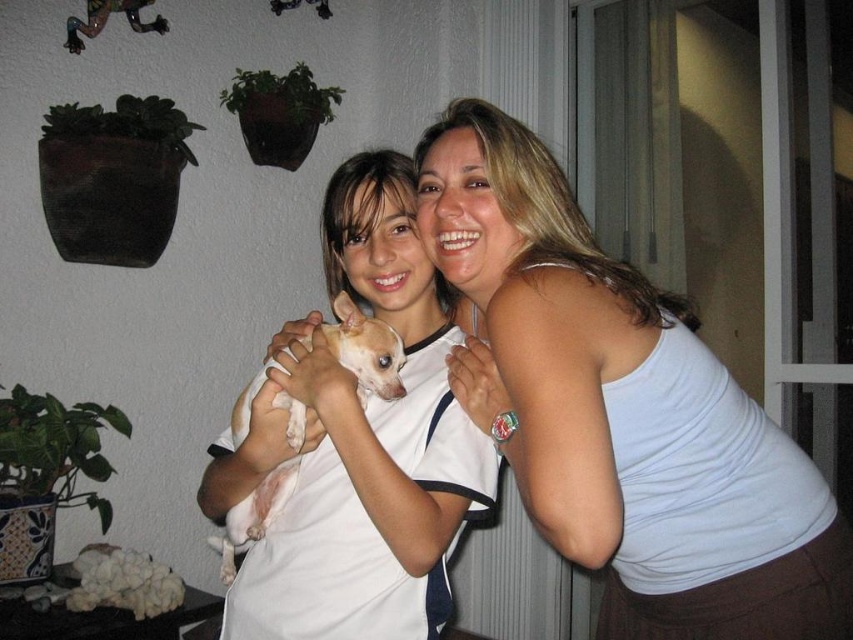
Question: Which point is closer to the camera?

Choices:
 (A) (737, 548)
 (B) (250, 531)
 (C) (363, 170)

Answer: (A)

Question: Which is nearer to the white soft fur dog at center?

Choices:
 (A) white soft fabric shirt at center
 (B) white tank top at upper right

Answer: (A)

Question: Estimate the real-world distances between objects in this image. Which object is farther from the white tank top at upper right?

Choices:
 (A) white soft fabric shirt at center
 (B) white soft fur dog at center

Answer: (B)

Question: Does white soft fabric shirt at center have a larger size compared to white soft fur dog at center?

Choices:
 (A) yes
 (B) no

Answer: (A)

Question: Is white soft fabric shirt at center closer to camera compared to white soft fur dog at center?

Choices:
 (A) yes
 (B) no

Answer: (A)

Question: Does white soft fabric shirt at center have a smaller size compared to white soft fur dog at center?

Choices:
 (A) no
 (B) yes

Answer: (A)